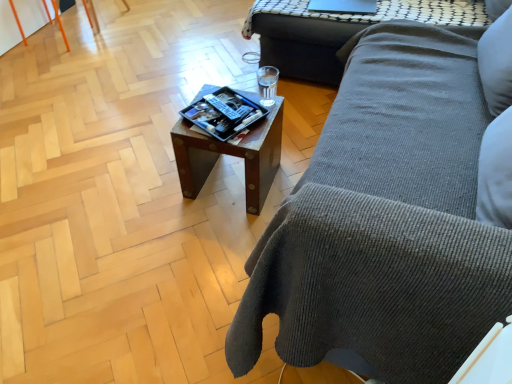
This screenshot has width=512, height=384. Describe the element at coordinates (231, 155) in the screenshot. I see `wooden tray at center, the 1th table when ordered from bottom to top` at that location.

Describe the element at coordinates (34, 15) in the screenshot. I see `orange plastic chair at upper left` at that location.

The height and width of the screenshot is (384, 512). In order to click on matte black tray at center in this screenshot , I will do `click(224, 113)`.

Is orange plastic chair at upper left in front of or behind matte black tray at center in the image?

Visually, orange plastic chair at upper left is located behind matte black tray at center.

Would you say orange plastic chair at upper left contains matte black tray at center?

No, matte black tray at center is not surrounded by orange plastic chair at upper left.

From the image's perspective, which one is positioned higher, orange plastic chair at upper left or matte black tray at center?

orange plastic chair at upper left is shown above in the image.

Does orange plastic chair at upper left have a smaller size compared to matte black tray at center?

No, orange plastic chair at upper left is not smaller than matte black tray at center.

Is wooden side table at upper right, the 1th table from the back, at the back of matte black tray at center?

Correct, matte black tray at center is looking away from wooden side table at upper right, the 1th table from the back.

Is matte black tray at center taller or shorter than wooden side table at upper right, which is the 2th table in bottom-to-top order?

In the image, matte black tray at center appears to be shorter than wooden side table at upper right, which is the 2th table in bottom-to-top order.

Looking at this image, from the image's perspective, between matte black tray at center and wooden side table at upper right, the 1th table from the back, who is located below?

matte black tray at center.

Considering the sizes of objects wooden side table at upper right, which is the 2th table in bottom-to-top order, and orange plastic chair at upper left in the image provided, who is shorter, wooden side table at upper right, which is the 2th table in bottom-to-top order, or orange plastic chair at upper left?

wooden side table at upper right, which is the 2th table in bottom-to-top order.

You are a GUI agent. You are given a task and a screenshot of the screen. Output one action in this format:
    pyautogui.click(x=<x>, y=<y>)
    Task: Click on the table that is the 2nd object above the orange plastic chair at upper left (from a real-world perspective)
    This screenshot has height=384, width=512.
    Given the screenshot: What is the action you would take?
    pyautogui.click(x=336, y=31)

Is point (298, 30) positioned before point (9, 44)?

Yes, it is.

Which of these two, wooden side table at upper right, marked as the second table in a left-to-right arrangement, or orange plastic chair at upper left, is smaller?

orange plastic chair at upper left is smaller.

From the image's perspective, is wooden side table at upper right, the 1th table from the back, located above wooden tray at center, acting as the 2th table starting from the right?

Indeed, from the image's perspective, wooden side table at upper right, the 1th table from the back, is shown above wooden tray at center, acting as the 2th table starting from the right.

Is point (286, 49) positioned in front of point (262, 121)?

That is False.

Is wooden side table at upper right, the 1th table from the back, taller than wooden tray at center, the 1th table positioned from the front?

Incorrect, the height of wooden side table at upper right, the 1th table from the back, is not larger of that of wooden tray at center, the 1th table positioned from the front.

In the image, is wooden side table at upper right, marked as the 2th table in a front-to-back arrangement, on the left side or the right side of wooden tray at center, acting as the 2th table starting from the back?

wooden side table at upper right, marked as the 2th table in a front-to-back arrangement, is positioned on wooden tray at center, acting as the 2th table starting from the back,'s right side.

Which of these two, matte black tray at center or wooden tray at center, acting as the 2th table starting from the right, is bigger?

With larger size is wooden tray at center, acting as the 2th table starting from the right.

Considering the sizes of objects matte black tray at center and wooden tray at center, positioned as the 2th table in top-to-bottom order, in the image provided, who is shorter, matte black tray at center or wooden tray at center, positioned as the 2th table in top-to-bottom order,?

matte black tray at center is shorter.

Is wooden tray at center, acting as the 2th table starting from the right, completely or partially inside matte black tray at center?

No.

Is matte black tray at center to the left or to the right of wooden tray at center, the 1th table when ordered from left to right, in the image?

matte black tray at center is positioned on wooden tray at center, the 1th table when ordered from left to right,'s left side.

Are gray corduroy couch at center and matte black tray at center far apart?

No, there isn't a large distance between gray corduroy couch at center and matte black tray at center.

Is gray corduroy couch at center facing away from matte black tray at center?

Absolutely, gray corduroy couch at center is directed away from matte black tray at center.

Identify the location of studio couch on the right of matte black tray at center. (385, 221).

Considering the sizes of gray corduroy couch at center and matte black tray at center in the image, is gray corduroy couch at center wider or thinner than matte black tray at center?

Clearly, gray corduroy couch at center has more width compared to matte black tray at center.

Is wooden side table at upper right, marked as the 2th table in a front-to-back arrangement, far from sleek black laptop at upper center?

No, there isn't a large distance between wooden side table at upper right, marked as the 2th table in a front-to-back arrangement, and sleek black laptop at upper center.

Which object is thinner, wooden side table at upper right, which is the 2th table in bottom-to-top order, or sleek black laptop at upper center?

With smaller width is sleek black laptop at upper center.

From the picture: From the image's perspective, is wooden side table at upper right, which is the 2th table in bottom-to-top order, on top of sleek black laptop at upper center?

Yes, from the image's perspective, wooden side table at upper right, which is the 2th table in bottom-to-top order, is above sleek black laptop at upper center.

This screenshot has width=512, height=384. Identify the location of chair below the matte black tray at center (from a real-world perspective). (34, 15).

The image size is (512, 384). In order to click on magazine on the left of wooden side table at upper right, which ranks as the first table in top-to-bottom order in this screenshot , I will do `click(224, 113)`.

Which object lies nearer to the anchor point wooden side table at upper right, marked as the 2th table in a front-to-back arrangement, orange plastic chair at upper left or matte black tray at center?

Among the two, matte black tray at center is located nearer to wooden side table at upper right, marked as the 2th table in a front-to-back arrangement.

From the image, which object appears to be nearer to wooden tray at center, the 1th table when ordered from bottom to top, orange plastic chair at upper left or sleek black laptop at upper center?

sleek black laptop at upper center lies closer to wooden tray at center, the 1th table when ordered from bottom to top, than the other object.

Based on their spatial positions, is gray corduroy couch at center or sleek black laptop at upper center closer to wooden tray at center, the 1th table positioned from the front?

Based on the image, gray corduroy couch at center appears to be nearer to wooden tray at center, the 1th table positioned from the front.

Estimate the real-world distances between objects in this image. Which object is further from orange plastic chair at upper left, wooden side table at upper right, the 1th table from the back, or wooden tray at center, the 1th table when ordered from left to right?

wooden tray at center, the 1th table when ordered from left to right, lies further to orange plastic chair at upper left than the other object.

Looking at this image, looking at the image, which one is located further to sleek black laptop at upper center, wooden side table at upper right, the 1th table positioned from the right, or matte black tray at center?

matte black tray at center lies further to sleek black laptop at upper center than the other object.

Which object lies further to the anchor point wooden tray at center, positioned as the 2th table in top-to-bottom order, sleek black laptop at upper center or orange plastic chair at upper left?

The object further to wooden tray at center, positioned as the 2th table in top-to-bottom order, is orange plastic chair at upper left.

From the picture: Estimate the real-world distances between objects in this image. Which object is closer to wooden side table at upper right, which ranks as the first table in top-to-bottom order, matte black tray at center or sleek black laptop at upper center?

The object closer to wooden side table at upper right, which ranks as the first table in top-to-bottom order, is sleek black laptop at upper center.

From the image, which object appears to be nearer to orange plastic chair at upper left, wooden tray at center, the 1th table when ordered from left to right, or matte black tray at center?

Among the two, matte black tray at center is located nearer to orange plastic chair at upper left.

Find the location of `magazine between sleek black laptop at upper center and wooden tray at center, positioned as the 2th table in top-to-bottom order, in the up-down direction`. magazine between sleek black laptop at upper center and wooden tray at center, positioned as the 2th table in top-to-bottom order, in the up-down direction is located at coordinates 224,113.

At what (x,y) coordinates should I click in order to perform the action: click on laptop located between orange plastic chair at upper left and wooden side table at upper right, marked as the 2th table in a front-to-back arrangement, in the left-right direction. Please return your answer as a coordinate pair (x, y). The image size is (512, 384). Looking at the image, I should click on (343, 6).

Where is `magazine located between orange plastic chair at upper left and sleek black laptop at upper center in the left-right direction`? This screenshot has width=512, height=384. magazine located between orange plastic chair at upper left and sleek black laptop at upper center in the left-right direction is located at coordinates (224, 113).

Identify the location of magazine between orange plastic chair at upper left and wooden side table at upper right, marked as the second table in a left-to-right arrangement. This screenshot has width=512, height=384. (224, 113).